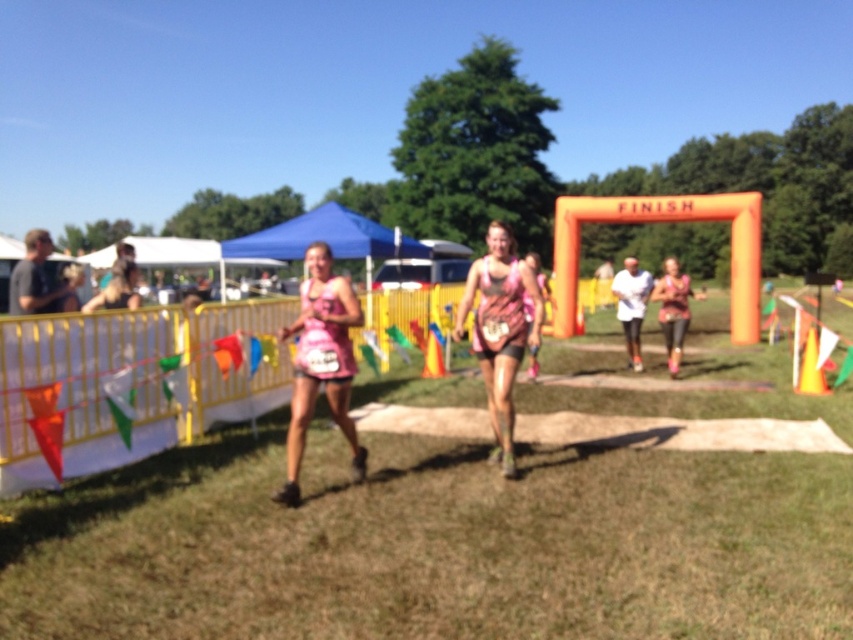
Is green grass at center to the right of pink fabric tank top at center from the viewer's perspective?

Correct, you'll find green grass at center to the right of pink fabric tank top at center.

Between point (599, 616) and point (310, 262), which one is positioned in front?

Positioned in front is point (599, 616).

Between point (583, 458) and point (354, 300), which one is positioned in front?

Positioned in front is point (354, 300).

This screenshot has width=853, height=640. What are the coordinates of `green grass at center` in the screenshot? It's located at (436, 538).

Can you confirm if green grass at center is thinner than pink fabric dress at center?

No, green grass at center is not thinner than pink fabric dress at center.

Can you confirm if green grass at center is shorter than pink fabric dress at center?

Yes, green grass at center is shorter than pink fabric dress at center.

At what (x,y) coordinates should I click in order to perform the action: click on green grass at center. Please return your answer as a coordinate pair (x, y). Looking at the image, I should click on (436, 538).

Is the position of pink fabric tank top at center more distant than that of matte pink tank top at center?

No, it is not.

The image size is (853, 640). What do you see at coordinates (320, 362) in the screenshot?
I see `pink fabric tank top at center` at bounding box center [320, 362].

Which is behind, point (321, 333) or point (674, 305)?

The point (674, 305) is more distant.

I want to click on pink fabric tank top at center, so click(x=320, y=362).